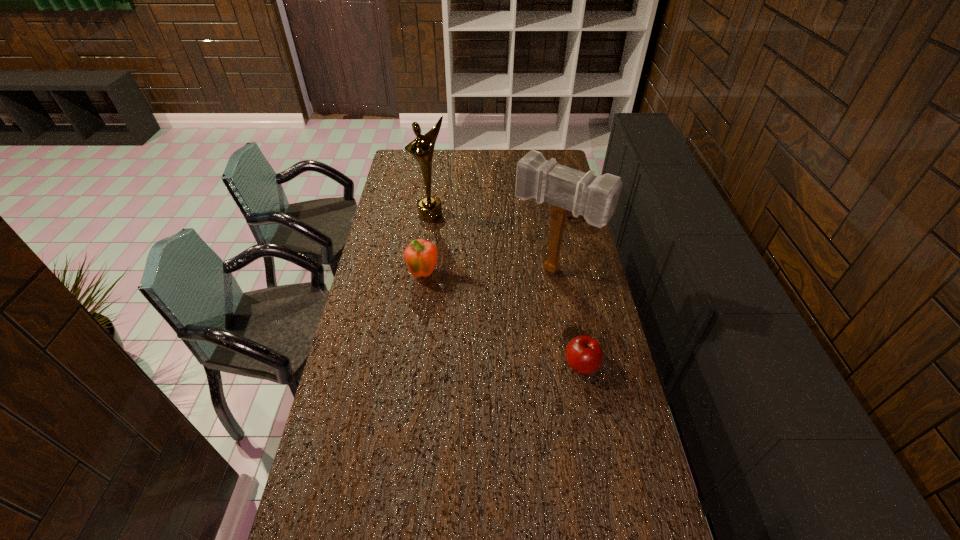
Where is `mallet located in the right edge section of the desktop`? This screenshot has height=540, width=960. mallet located in the right edge section of the desktop is located at coordinates (594, 197).

This screenshot has height=540, width=960. Identify the location of free space at the far edge. (467, 160).

The height and width of the screenshot is (540, 960). In order to click on blank space at the near edge of the desktop in this screenshot , I will do `click(582, 532)`.

Image resolution: width=960 pixels, height=540 pixels. In the image, there is a desktop. What are the coordinates of `vacant region at the left edge` in the screenshot? It's located at (382, 276).

Where is `vacant area at the right edge of the desktop`? This screenshot has height=540, width=960. vacant area at the right edge of the desktop is located at coordinates (587, 431).

Where is `free point between the nearest object and the pepper`? free point between the nearest object and the pepper is located at coordinates click(503, 320).

I want to click on empty space between the third shortest object and the mallet, so 489,273.

Find the location of `vacant region between the third tallest object and the apple`. vacant region between the third tallest object and the apple is located at coordinates (503, 320).

At what (x,y) coordinates should I click in order to perform the action: click on free spot between the nearest object and the pepper. Please return your answer as a coordinate pair (x, y). The image size is (960, 540). Looking at the image, I should click on (503, 320).

Image resolution: width=960 pixels, height=540 pixels. I want to click on vacant space that's between the cup and the apple, so click(x=574, y=289).